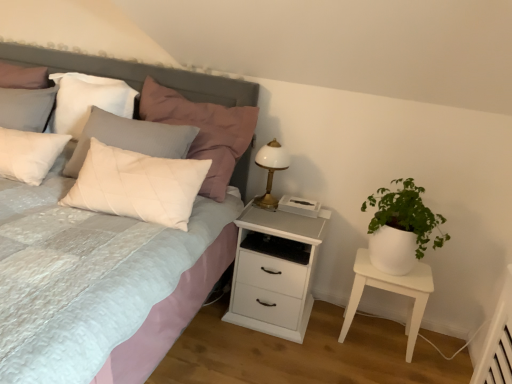
The width and height of the screenshot is (512, 384). What are the coordinates of `free region on the left part of white matte table at right` in the screenshot? It's located at (326, 337).